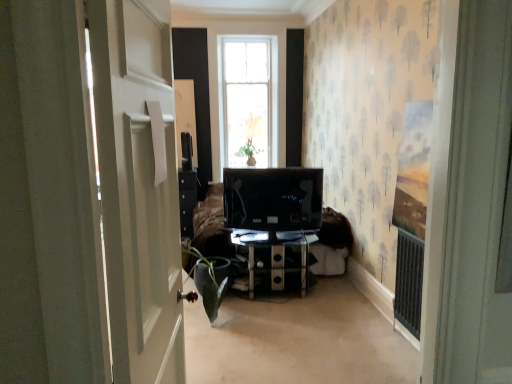
Image resolution: width=512 pixels, height=384 pixels. I want to click on transparent glass tv stand at center, so click(274, 261).

At what (x,y) coordinates should I click in order to perform the action: click on transparent glass tv stand at center. Please return your answer as a coordinate pair (x, y). Looking at the image, I should click on (274, 261).

Considering the sizes of objects green matte plant at lower left and transparent glass tv stand at center in the image provided, who is thinner, green matte plant at lower left or transparent glass tv stand at center?

transparent glass tv stand at center is thinner.

Locate an element on the screen. The width and height of the screenshot is (512, 384). furniture that is behind the green matte plant at lower left is located at coordinates (274, 261).

Is green matte plant at lower left facing towards transparent glass tv stand at center?

No, green matte plant at lower left is not turned towards transparent glass tv stand at center.

Which of these two, green matte plant at lower left or transparent glass tv stand at center, stands shorter?

transparent glass tv stand at center is shorter.

Is matte black monitor at center oriented towards white glossy door at left?

No, matte black monitor at center is not oriented towards white glossy door at left.

Which of these two, matte black monitor at center or white glossy door at left, is bigger?

With larger size is white glossy door at left.

Locate an element on the screen. Image resolution: width=512 pixels, height=384 pixels. door in front of the matte black monitor at center is located at coordinates (138, 186).

Can you tell me how much matte black monitor at center and white glossy door at left differ in facing direction?

The facing directions of matte black monitor at center and white glossy door at left are 93.1 degrees apart.

At what (x,y) coordinates should I click in order to perform the action: click on furniture lying on the right of white glossy door at left. Please return your answer as a coordinate pair (x, y). The image size is (512, 384). Looking at the image, I should click on (274, 261).

From a real-world perspective, is transparent glass tv stand at center beneath white glossy door at left?

Correct, in the physical world, transparent glass tv stand at center is lower than white glossy door at left.

Does transparent glass tv stand at center turn towards white glossy door at left?

No, transparent glass tv stand at center is not facing towards white glossy door at left.

From the image's perspective, between matte black monitor at center and transparent glass tv stand at center, which one is located above?

matte black monitor at center, from the image's perspective.

Are matte black monitor at center and transparent glass tv stand at center beside each other?

No, matte black monitor at center is not with transparent glass tv stand at center.

From a real-world perspective, between matte black monitor at center and transparent glass tv stand at center, who is vertically higher?

matte black monitor at center is physically above.

Are matte black monitor at center and green matte plant at lower left located far from each other?

Actually, matte black monitor at center and green matte plant at lower left are a little close together.

Based on the photo, is matte black monitor at center wider than green matte plant at lower left?

No, matte black monitor at center is not wider than green matte plant at lower left.

Considering the relative sizes of matte black monitor at center and green matte plant at lower left in the image provided, is matte black monitor at center bigger than green matte plant at lower left?

Actually, matte black monitor at center might be smaller than green matte plant at lower left.

Is point (206, 263) closer to camera compared to point (139, 88)?

No.

Which of these two, green matte plant at lower left or white glossy door at left, stands shorter?

green matte plant at lower left.

Based on the photo, considering the positions of objects green matte plant at lower left and white glossy door at left in the image provided, who is behind, green matte plant at lower left or white glossy door at left?

Positioned behind is green matte plant at lower left.

Do you think green matte plant at lower left is within white glossy door at left, or outside of it?

green matte plant at lower left cannot be found inside white glossy door at left.

Is the surface of green matte plant at lower left in direct contact with matte black monitor at center?

No, green matte plant at lower left is not next to matte black monitor at center.

Is matte black monitor at center completely or partially inside green matte plant at lower left?

No, green matte plant at lower left does not contain matte black monitor at center.

Is green matte plant at lower left aimed at matte black monitor at center?

No, green matte plant at lower left is not turned towards matte black monitor at center.

Does green matte plant at lower left have a larger size compared to matte black monitor at center?

Yes.

You are a GUI agent. You are given a task and a screenshot of the screen. Output one action in this format:
    pyautogui.click(x=<x>, y=<y>)
    Task: Click on the furniture behind the green matte plant at lower left
    The image size is (512, 384).
    Given the screenshot: What is the action you would take?
    pyautogui.click(x=274, y=261)

This screenshot has height=384, width=512. I want to click on door above the matte black monitor at center (from a real-world perspective), so point(138,186).

Considering their positions, is green matte plant at lower left positioned further to white glossy door at left than matte black monitor at center?

matte black monitor at center.

Considering their positions, is transparent glass tv stand at center positioned closer to green matte plant at lower left than white glossy door at left?

Based on the image, transparent glass tv stand at center appears to be nearer to green matte plant at lower left.

Estimate the real-world distances between objects in this image. Which object is further from matte black monitor at center, green matte plant at lower left or white glossy door at left?

The object further to matte black monitor at center is white glossy door at left.

Based on their spatial positions, is transparent glass tv stand at center or matte black monitor at center further from white glossy door at left?

matte black monitor at center lies further to white glossy door at left than the other object.

Estimate the real-world distances between objects in this image. Which object is closer to green matte plant at lower left, matte black monitor at center or transparent glass tv stand at center?

transparent glass tv stand at center is positioned closer to the anchor green matte plant at lower left.

Consider the image. Looking at the image, which one is located further to green matte plant at lower left, white glossy door at left or matte black monitor at center?

white glossy door at left is positioned further to the anchor green matte plant at lower left.

Considering their positions, is matte black monitor at center positioned further to transparent glass tv stand at center than green matte plant at lower left?

The object further to transparent glass tv stand at center is green matte plant at lower left.

Considering their positions, is transparent glass tv stand at center positioned further to matte black monitor at center than white glossy door at left?

white glossy door at left.

This screenshot has width=512, height=384. I want to click on plant between white glossy door at left and matte black monitor at center along the z-axis, so click(x=208, y=278).

The height and width of the screenshot is (384, 512). I want to click on computer monitor between white glossy door at left and transparent glass tv stand at center from front to back, so coord(273,198).

At what (x,y) coordinates should I click in order to perform the action: click on computer monitor located between green matte plant at lower left and transparent glass tv stand at center in the left-right direction. Please return your answer as a coordinate pair (x, y). The height and width of the screenshot is (384, 512). Looking at the image, I should click on (273, 198).

You are a GUI agent. You are given a task and a screenshot of the screen. Output one action in this format:
    pyautogui.click(x=<x>, y=<y>)
    Task: Click on the plant between white glossy door at left and transparent glass tv stand at center along the z-axis
    
    Given the screenshot: What is the action you would take?
    pyautogui.click(x=208, y=278)